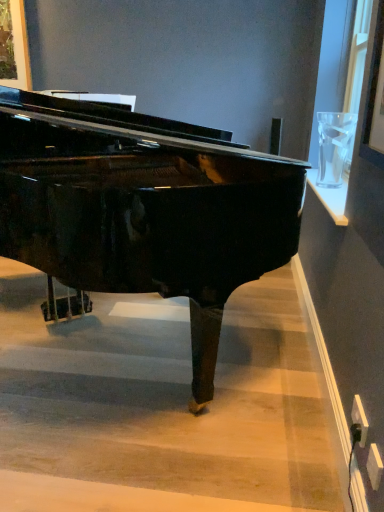
Find the location of a particular element. This screenshot has height=512, width=384. free region under glossy black piano at center (from a real-world perspective) is located at coordinates (117, 360).